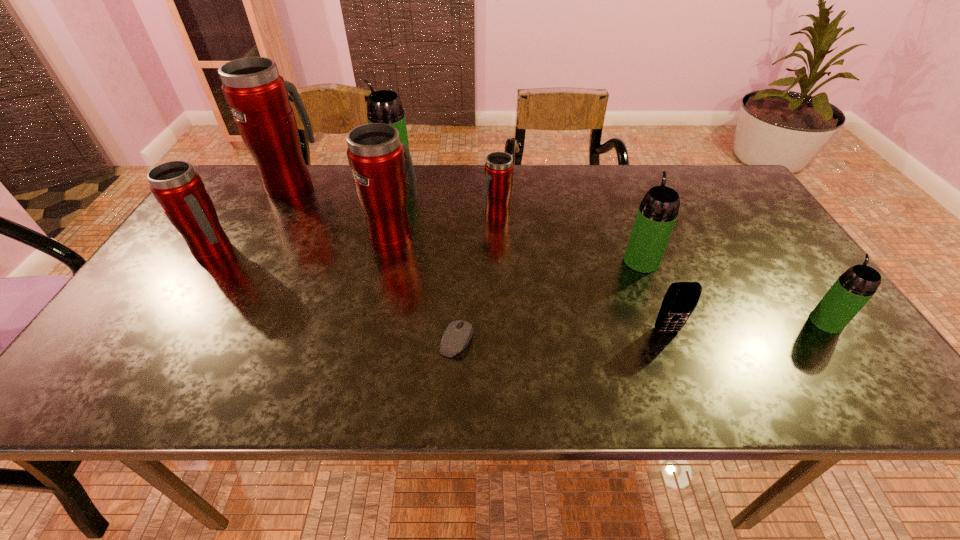
Find the location of `vacant space located 0.050m on the left of the shortest object`. vacant space located 0.050m on the left of the shortest object is located at coordinates (416, 340).

You are a GUI agent. You are given a task and a screenshot of the screen. Output one action in this format:
    pyautogui.click(x=<x>, y=<y>)
    Task: Click on the object that is at the right edge
    
    Given the screenshot: What is the action you would take?
    pyautogui.click(x=854, y=288)

The height and width of the screenshot is (540, 960). I want to click on object that is at the far left corner, so click(x=258, y=97).

Where is `vacant region at the far edge of the desktop`? vacant region at the far edge of the desktop is located at coordinates (515, 194).

In order to click on free space at the near edge in this screenshot , I will do `click(750, 367)`.

This screenshot has width=960, height=540. In the image, there is a desktop. Identify the location of vacant space at the left edge. coord(164,347).

Locate an element on the screen. This screenshot has width=960, height=540. vacant space at the right edge of the desktop is located at coordinates (840, 339).

In the image, there is a desktop. Identify the location of vacant space at the far left corner. The height and width of the screenshot is (540, 960). (241, 184).

This screenshot has height=540, width=960. What are the coordinates of `vacant space at the far right corner` in the screenshot? It's located at (700, 173).

Locate an element on the screen. free point between the cellular telephone and the third smallest red thermos bottle is located at coordinates tap(530, 283).